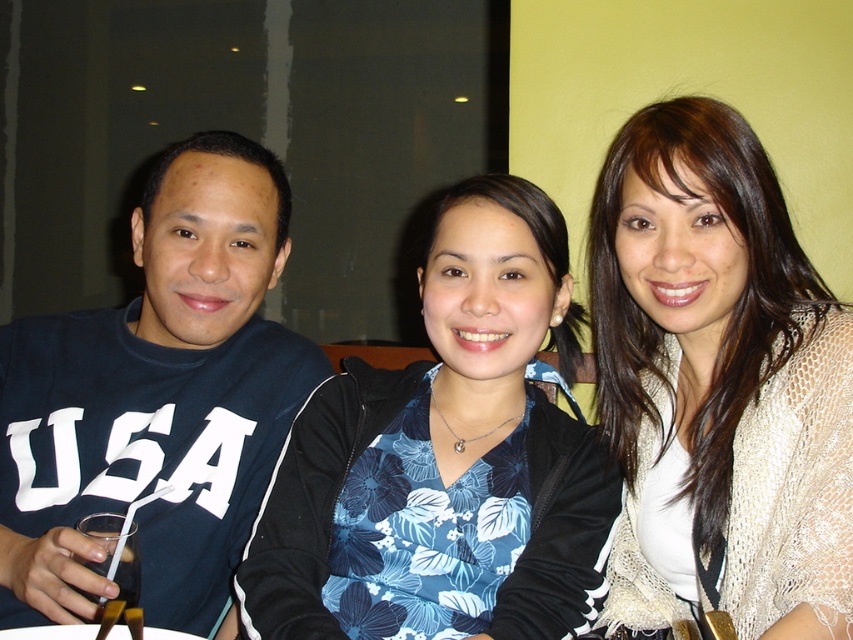
Based on the photo, you are a photographer taking a picture of the group. You notice the white lace shawl at center and the blue fabric shirt at left. Which one should you focus on to ensure it appears larger in the photo?

The white lace shawl at center is closer to the viewer than the blue fabric shirt at left, so focusing on it will make it appear larger in the photo.

You are organizing a photoshoot and need to ensure that the white lace shawl at center and the blue floral blouse at center are visible. Based on the scene description, which item is positioned closer to the camera?

The white lace shawl at center is in front of the blue floral blouse at center, so it is closer to the camera.

You are a photographer trying to capture a candid shot of the blue fabric shirt at left without the white lace shawl at center showing in the frame. Is this possible given their positions?

The white lace shawl at center is positioned under the blue fabric shirt at left, so it might be possible to angle the camera to avoid capturing the white lace shawl at center while focusing on the blue fabric shirt at left.